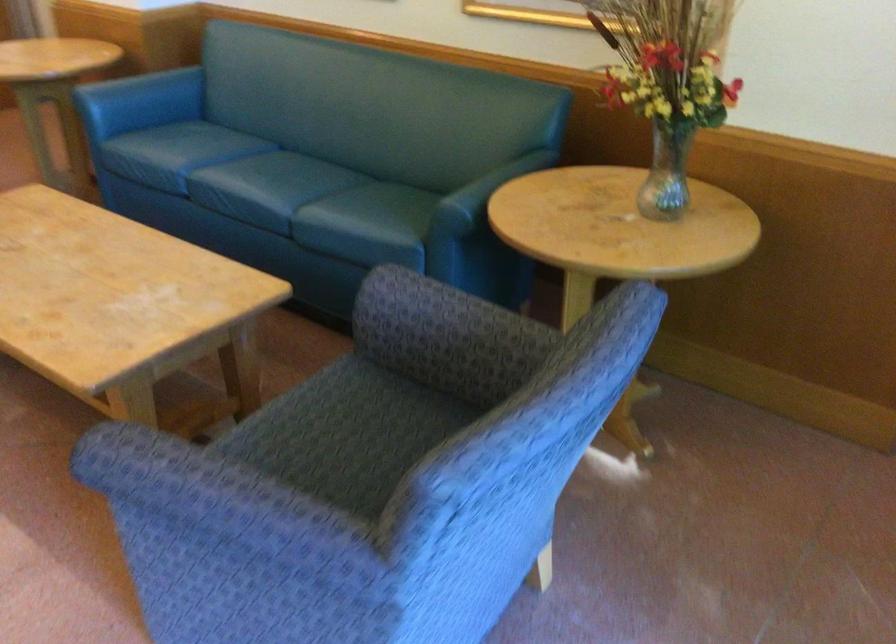
What do you see at coordinates (204, 488) in the screenshot?
I see `the patterned chair armrest` at bounding box center [204, 488].